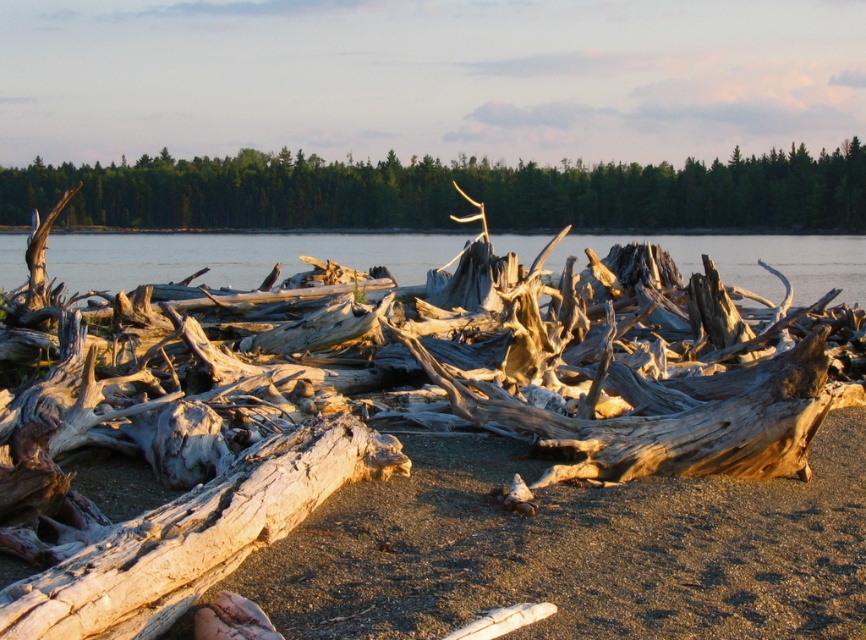
You are a hiker who needs to decide which object to use as a makeshift walking stick. Considering their height, which one between the smooth bark tree trunk at upper center and the light brown wood at center would be more suitable for your height?

The smooth bark tree trunk at upper center is much taller than the light brown wood at center, so it would be more suitable as a makeshift walking stick for your height.

You are a photographer planning to capture the scene. You want to ensure that the smooth bark tree trunk at upper center and the clear water at center are both visible in your shot. Based on their sizes, which object should you frame first to ensure it fits within the composition?

The smooth bark tree trunk at upper center is wider than the clear water at center, so you should frame the smooth bark tree trunk at upper center first to ensure it fits within the composition.